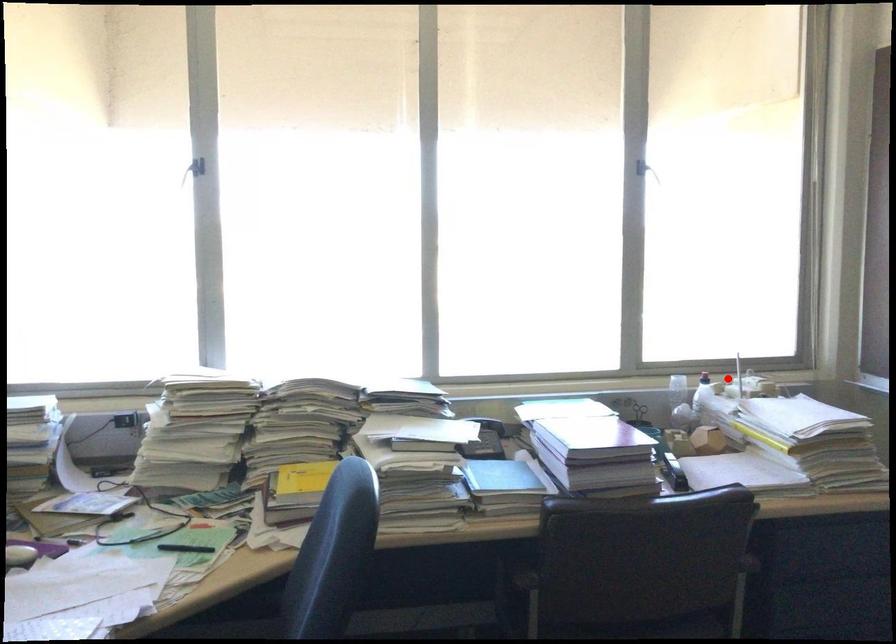
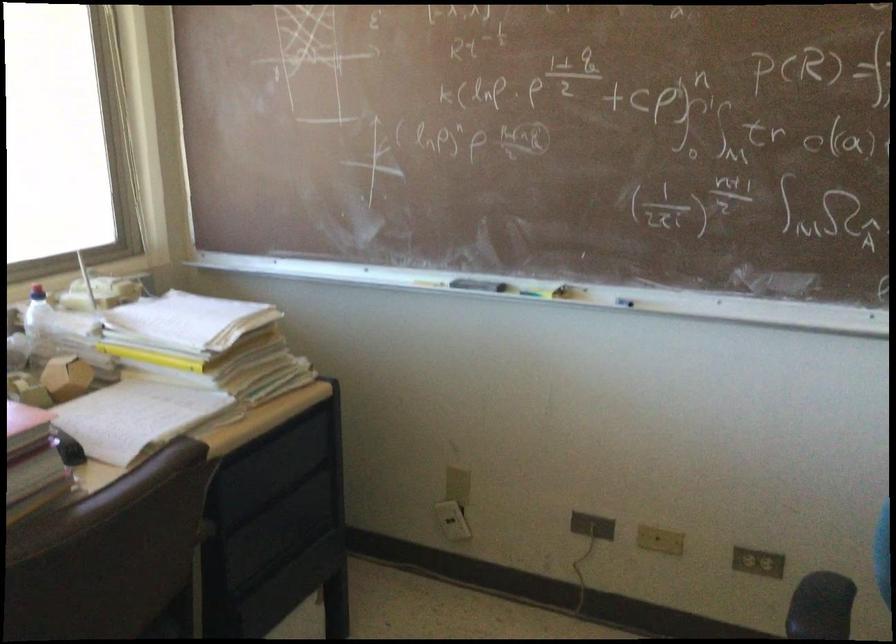
Question: I am providing you with two images of the same scene from different viewpoints. A red point is marked on the first image. Is the red point's position out of view in image 2?

Choices:
 (A) Yes
 (B) No

Answer: (B)